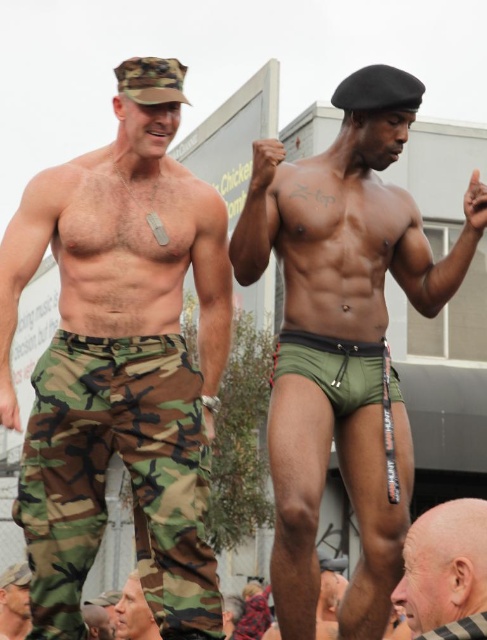
Question: Which point appears closest to the camera in this image?

Choices:
 (A) (115, 608)
 (B) (168, 592)
 (C) (347, 483)
 (D) (10, 620)

Answer: (B)

Question: Which point is closer to the camera taking this photo?

Choices:
 (A) (426, 556)
 (B) (355, 152)
 (C) (144, 195)
 (D) (135, 627)

Answer: (A)

Question: Among these points, which one is nearest to the camera?

Choices:
 (A) (12, 381)
 (B) (349, 280)
 (C) (125, 637)

Answer: (A)

Question: Is green matte shorts at center to the right of bald head at lower right from the viewer's perspective?

Choices:
 (A) no
 (B) yes

Answer: (A)

Question: Does camo pants at left have a lesser width compared to bald head at lower right?

Choices:
 (A) yes
 (B) no

Answer: (B)

Question: Is bald head at lower right above camouflage pants at lower left?

Choices:
 (A) yes
 (B) no

Answer: (A)